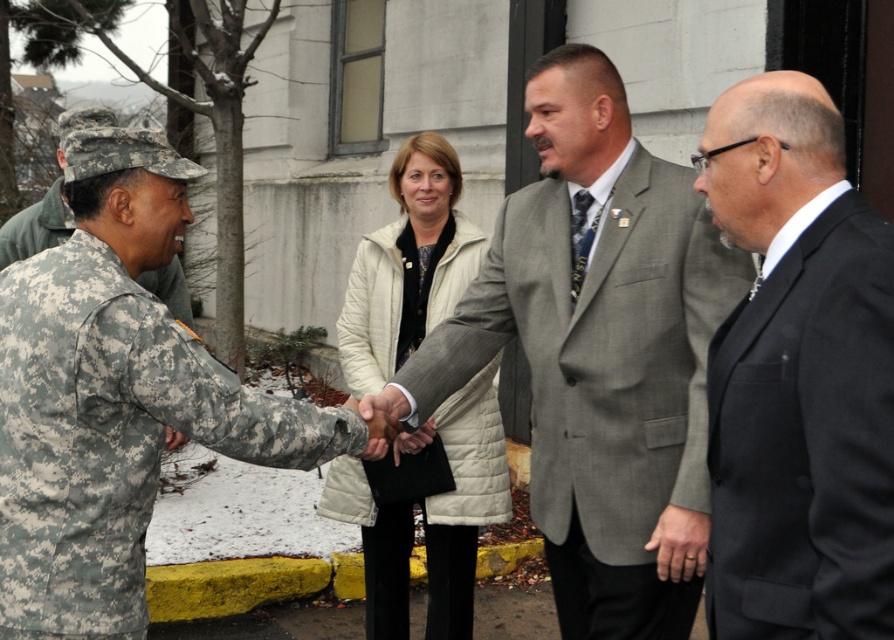
You are a photographer positioned behind the black matte suit at right and the light beige quilted jacket at center. The minimum distance required between you and your subjects for a clear photo is 2 meters. Can you take the photo from your current position?

The black matte suit at right and light beige quilted jacket at center are 1.85 meters apart. Since the required distance is 2 meters, you need to move back further to ensure a clear photo.

In the formal outdoor scene, there are two people wearing the black matte suit at right and the light beige quilted jacket at center. Which one appears to be smaller in size?

The black matte suit at right has a smaller size compared to the light beige quilted jacket at center, so the black matte suit at right appears smaller.